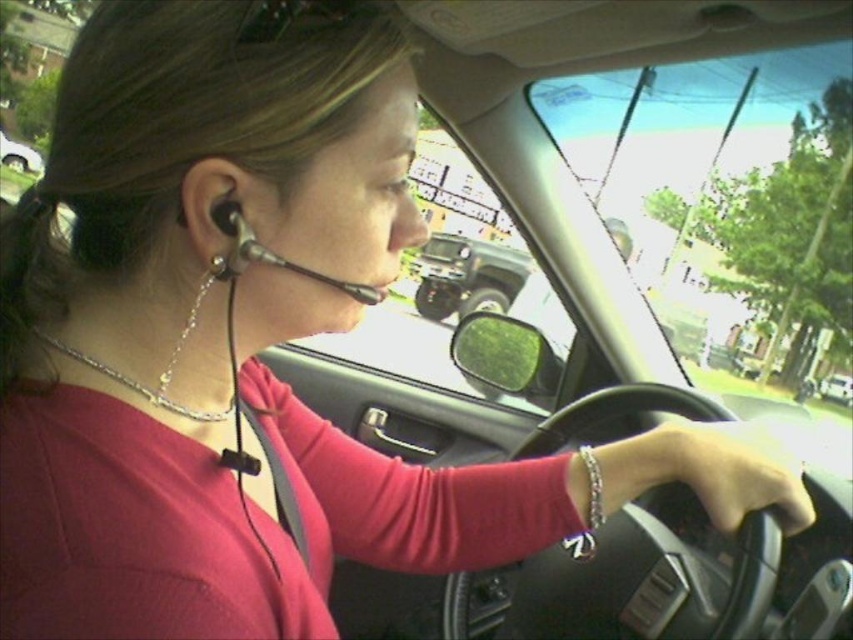
You are sitting in the passenger seat of the car shown. You notice two points inside the car. The first point is at coordinates point (523, 282) and the second is at point (215, 266). If you reach out your hand from where you are sitting, which point can you touch first?

Point (523, 282) is closer to you than point (215, 266), so you can touch point (523, 282) first.

You are a delivery driver who needs to park your car next to a green matte truck at center. The parking space is exactly 5 meters long. Can your car fit in the space if you align the front bumper with the truck?

The distance between your car and the green matte truck at center is 4.80 meters. Since the parking space is 5 meters long, your car can fit as there is enough space between them.

You are a passenger in a car and notice two objects inside the vehicle. The green matte truck at center and the black matte earphone at left. Which object takes up more space in the car?

The green matte truck at center takes up more space in the car than the black matte earphone at left because it is bigger.